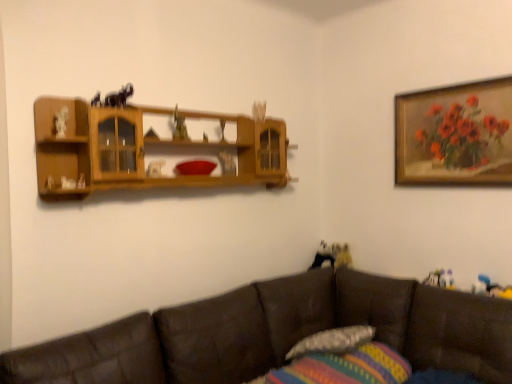
Measure the distance between textured fabric pillow at lower center, which appears as the 1th pillow when viewed from the top, and camera.

The distance of textured fabric pillow at lower center, which appears as the 1th pillow when viewed from the top, from camera is 2.34 meters.

Locate an element on the screen. This screenshot has height=384, width=512. wooden framed painting of flowers at upper right is located at coordinates (455, 135).

From a real-world perspective, is brown leather couch at lower right over textured fabric pillow at lower center, which appears as the 1th pillow when viewed from the top?

No, from a real-world perspective, brown leather couch at lower right is not over textured fabric pillow at lower center, which appears as the 1th pillow when viewed from the top

Looking at their sizes, would you say brown leather couch at lower right is wider or thinner than textured fabric pillow at lower center, which appears as the 1th pillow when viewed from the top?

Clearly, brown leather couch at lower right has more width compared to textured fabric pillow at lower center, which appears as the 1th pillow when viewed from the top.

Is brown leather couch at lower right outside of textured fabric pillow at lower center, which is the second pillow from bottom to top?

That's correct, brown leather couch at lower right is outside of textured fabric pillow at lower center, which is the second pillow from bottom to top.

Measure the distance from brown leather couch at lower right to textured fabric pillow at lower center, which is the second pillow from bottom to top.

brown leather couch at lower right is 36.10 centimeters from textured fabric pillow at lower center, which is the second pillow from bottom to top.

From a real-world perspective, between wooden framed painting of flowers at upper right and wooden shelf at upper center, who is vertically higher?

wooden framed painting of flowers at upper right is physically above.

Is wooden framed painting of flowers at upper right positioned in front of wooden shelf at upper center?

No, it is not.

Are wooden framed painting of flowers at upper right and wooden shelf at upper center located far from each other?

Absolutely, wooden framed painting of flowers at upper right is distant from wooden shelf at upper center.

Considering the sizes of wooden framed painting of flowers at upper right and wooden shelf at upper center in the image, is wooden framed painting of flowers at upper right wider or thinner than wooden shelf at upper center?

Clearly, wooden framed painting of flowers at upper right has less width compared to wooden shelf at upper center.

Which of these two, wooden framed painting of flowers at upper right or striped fabric pillow at lower center, which ranks as the 1th pillow in bottom-to-top order, stands taller?

wooden framed painting of flowers at upper right.

Can you tell me how much wooden framed painting of flowers at upper right and striped fabric pillow at lower center, which ranks as the 1th pillow in bottom-to-top order, differ in facing direction?

The angular difference between wooden framed painting of flowers at upper right and striped fabric pillow at lower center, which ranks as the 1th pillow in bottom-to-top order, is 86.7 degrees.

Is wooden framed painting of flowers at upper right closer to camera compared to striped fabric pillow at lower center, the 2th pillow viewed from the top?

No, wooden framed painting of flowers at upper right is behind striped fabric pillow at lower center, the 2th pillow viewed from the top.

Do you think wooden framed painting of flowers at upper right is within striped fabric pillow at lower center, which ranks as the 1th pillow in bottom-to-top order, or outside of it?

wooden framed painting of flowers at upper right lies outside striped fabric pillow at lower center, which ranks as the 1th pillow in bottom-to-top order.

Does striped fabric pillow at lower center, which ranks as the 1th pillow in bottom-to-top order, turn towards wooden framed painting of flowers at upper right?

No, striped fabric pillow at lower center, which ranks as the 1th pillow in bottom-to-top order, is not oriented towards wooden framed painting of flowers at upper right.

From a real-world perspective, is striped fabric pillow at lower center, which ranks as the 1th pillow in bottom-to-top order, physically above wooden framed painting of flowers at upper right?

No, from a real-world perspective, striped fabric pillow at lower center, which ranks as the 1th pillow in bottom-to-top order, is not on top of wooden framed painting of flowers at upper right.

Locate an element on the screen. The width and height of the screenshot is (512, 384). the 2nd pillow counting from the left side of the wooden framed painting of flowers at upper right is located at coordinates (345, 367).

From their relative heights in the image, would you say striped fabric pillow at lower center, which ranks as the 1th pillow in bottom-to-top order, is taller or shorter than wooden framed painting of flowers at upper right?

striped fabric pillow at lower center, which ranks as the 1th pillow in bottom-to-top order, is shorter than wooden framed painting of flowers at upper right.

Does point (54, 124) appear closer or farther from the camera than point (457, 162)?

Clearly, point (54, 124) is closer to the camera than point (457, 162).

Considering the relative sizes of wooden shelf at upper center and wooden framed painting of flowers at upper right in the image provided, is wooden shelf at upper center taller than wooden framed painting of flowers at upper right?

No, wooden shelf at upper center is not taller than wooden framed painting of flowers at upper right.

Can you see wooden shelf at upper center touching wooden framed painting of flowers at upper right?

No, wooden shelf at upper center is not in contact with wooden framed painting of flowers at upper right.

Can you tell me how much textured fabric pillow at lower center, which is the second pillow from bottom to top, and striped fabric pillow at lower center, the 2th pillow viewed from the top, differ in facing direction?

textured fabric pillow at lower center, which is the second pillow from bottom to top, and striped fabric pillow at lower center, the 2th pillow viewed from the top, are facing 11.6 degrees away from each other.

Do you think textured fabric pillow at lower center, which is the second pillow from bottom to top, is within striped fabric pillow at lower center, the 2th pillow viewed from the top, or outside of it?

textured fabric pillow at lower center, which is the second pillow from bottom to top, exists outside the volume of striped fabric pillow at lower center, the 2th pillow viewed from the top.

Is textured fabric pillow at lower center, which appears as the 1th pillow when viewed from the top, to the right of striped fabric pillow at lower center, the 2th pillow viewed from the top, from the viewer's perspective?

Yes, textured fabric pillow at lower center, which appears as the 1th pillow when viewed from the top, is to the right of striped fabric pillow at lower center, the 2th pillow viewed from the top.

Between textured fabric pillow at lower center, which is the second pillow from bottom to top, and striped fabric pillow at lower center, which ranks as the 1th pillow in bottom-to-top order, which one has less height?

With less height is textured fabric pillow at lower center, which is the second pillow from bottom to top.

Which of these two, textured fabric pillow at lower center, which is the second pillow from bottom to top, or brown leather couch at lower right, stands shorter?

With less height is textured fabric pillow at lower center, which is the second pillow from bottom to top.

Is textured fabric pillow at lower center, which is the second pillow from bottom to top, directly adjacent to brown leather couch at lower right?

They are not placed beside each other.

Who is smaller, textured fabric pillow at lower center, which is the second pillow from bottom to top, or brown leather couch at lower right?

textured fabric pillow at lower center, which is the second pillow from bottom to top.

From the picture: From a real-world perspective, which object rests below the other?

brown leather couch at lower right.

I want to click on studio couch on the left of textured fabric pillow at lower center, which appears as the 1th pillow when viewed from the top, so click(x=278, y=333).

Where is `shelf lying in front of the wooden framed painting of flowers at upper right`? shelf lying in front of the wooden framed painting of flowers at upper right is located at coordinates (144, 149).

Looking at this image, which object lies further to the anchor point wooden shelf at upper center, striped fabric pillow at lower center, the 2th pillow viewed from the top, or textured fabric pillow at lower center, which is the second pillow from bottom to top?

striped fabric pillow at lower center, the 2th pillow viewed from the top, is positioned further to the anchor wooden shelf at upper center.

Based on their spatial positions, is wooden framed painting of flowers at upper right or striped fabric pillow at lower center, the 2th pillow viewed from the top, closer to brown leather couch at lower right?

The object closer to brown leather couch at lower right is striped fabric pillow at lower center, the 2th pillow viewed from the top.

From the image, which object appears to be farther from wooden framed painting of flowers at upper right, textured fabric pillow at lower center, which is the second pillow from bottom to top, or brown leather couch at lower right?

textured fabric pillow at lower center, which is the second pillow from bottom to top, is positioned further to the anchor wooden framed painting of flowers at upper right.

Looking at the image, which one is located further to wooden shelf at upper center, wooden framed painting of flowers at upper right or brown leather couch at lower right?

The object further to wooden shelf at upper center is wooden framed painting of flowers at upper right.

Based on their spatial positions, is textured fabric pillow at lower center, which is the second pillow from bottom to top, or wooden framed painting of flowers at upper right further from striped fabric pillow at lower center, which ranks as the 1th pillow in bottom-to-top order?

wooden framed painting of flowers at upper right is further to striped fabric pillow at lower center, which ranks as the 1th pillow in bottom-to-top order.

Looking at the image, which one is located further to brown leather couch at lower right, wooden framed painting of flowers at upper right or wooden shelf at upper center?

wooden framed painting of flowers at upper right lies further to brown leather couch at lower right than the other object.

From the image, which object appears to be nearer to wooden framed painting of flowers at upper right, textured fabric pillow at lower center, which appears as the 1th pillow when viewed from the top, or striped fabric pillow at lower center, which ranks as the 1th pillow in bottom-to-top order?

textured fabric pillow at lower center, which appears as the 1th pillow when viewed from the top, is closer to wooden framed painting of flowers at upper right.

Looking at the image, which one is located closer to brown leather couch at lower right, wooden shelf at upper center or wooden framed painting of flowers at upper right?

wooden shelf at upper center is closer to brown leather couch at lower right.

Locate an element on the screen. This screenshot has height=384, width=512. pillow between brown leather couch at lower right and wooden shelf at upper center in the front-back direction is located at coordinates pos(345,367).

The height and width of the screenshot is (384, 512). Identify the location of shelf between brown leather couch at lower right and textured fabric pillow at lower center, which appears as the 1th pillow when viewed from the top, in the front-back direction. (144, 149).

Identify the location of pillow between wooden framed painting of flowers at upper right and striped fabric pillow at lower center, which ranks as the 1th pillow in bottom-to-top order, in the up-down direction. (333, 341).

This screenshot has width=512, height=384. In order to click on pillow that lies between wooden shelf at upper center and striped fabric pillow at lower center, the 2th pillow viewed from the top, from top to bottom in this screenshot , I will do `click(333, 341)`.